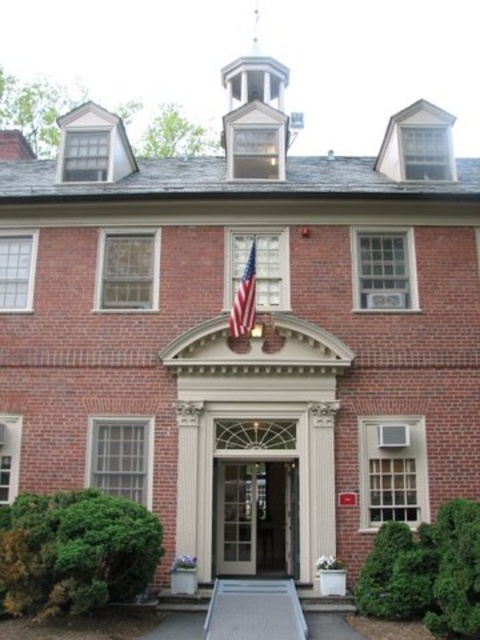
Is clear glass door at center below american flag at center?

Yes, clear glass door at center is below american flag at center.

Is point (218, 504) behind point (245, 294)?

Yes, point (218, 504) is behind point (245, 294).

Find the location of a particular element. The image size is (480, 640). clear glass door at center is located at coordinates (255, 516).